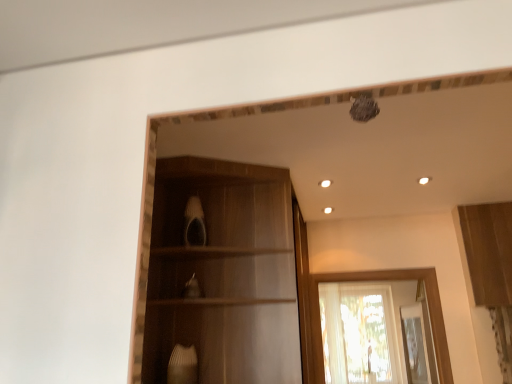
Question: Does point (166, 172) appear closer or farther from the camera than point (495, 208)?

Choices:
 (A) closer
 (B) farther

Answer: (A)

Question: Looking at the image, does wooden cabinet at center, the first cabinetry positioned from the left, seem bigger or smaller compared to wooden cabinet at upper right, the second cabinetry in the left-to-right sequence?

Choices:
 (A) big
 (B) small

Answer: (A)

Question: Which of these objects is positioned farthest from the translucent fabric window at center?

Choices:
 (A) wooden cabinet at upper right, the second cabinetry in the left-to-right sequence
 (B) wooden cabinet at center, the 2th cabinetry when ordered from right to left

Answer: (B)

Question: Based on their relative distances, which object is farther from the wooden cabinet at center, the first cabinetry positioned from the left?

Choices:
 (A) wooden cabinet at upper right, the second cabinetry in the left-to-right sequence
 (B) translucent fabric window at center

Answer: (A)